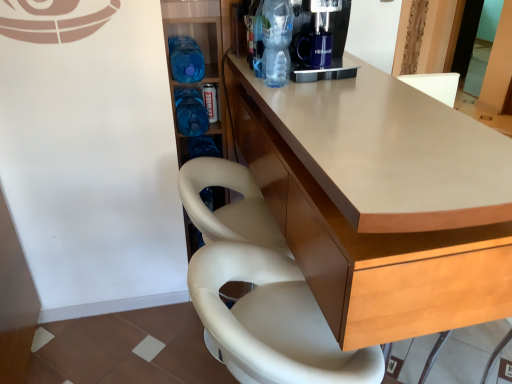
Question: Which is correct: blue plastic bottle at center-left, which is the second bottle in left-to-right order, is inside matte wood counter at center, or outside of it?

Choices:
 (A) inside
 (B) outside

Answer: (B)

Question: From the image's perspective, is blue plastic bottle at center-left, which is the second bottle in left-to-right order, above or below matte wood counter at center?

Choices:
 (A) below
 (B) above

Answer: (B)

Question: Which object is the farthest from the matte wood counter at center?

Choices:
 (A) white leather chair at lower center
 (B) blue plastic water bottles at left
 (C) blue plastic bottle at center-left, marked as the 2th bottle in a front-to-back arrangement
 (D) blue plastic bottle at center-left, placed as the third bottle when sorted from front to back
 (E) translucent plastic bottle at upper center, which appears as the 3th bottle when viewed from the back

Answer: (C)

Question: Which is nearer to the matte wood counter at center?

Choices:
 (A) translucent plastic bottle at upper center, which appears as the first bottle when viewed from the front
 (B) blue plastic water bottles at left
 (C) blue plastic bottle at center-left, arranged as the 2th bottle when viewed from the right
 (D) blue plastic bottle at center-left, marked as the 2th bottle in a front-to-back arrangement
 (E) white leather chair at lower center

Answer: (E)